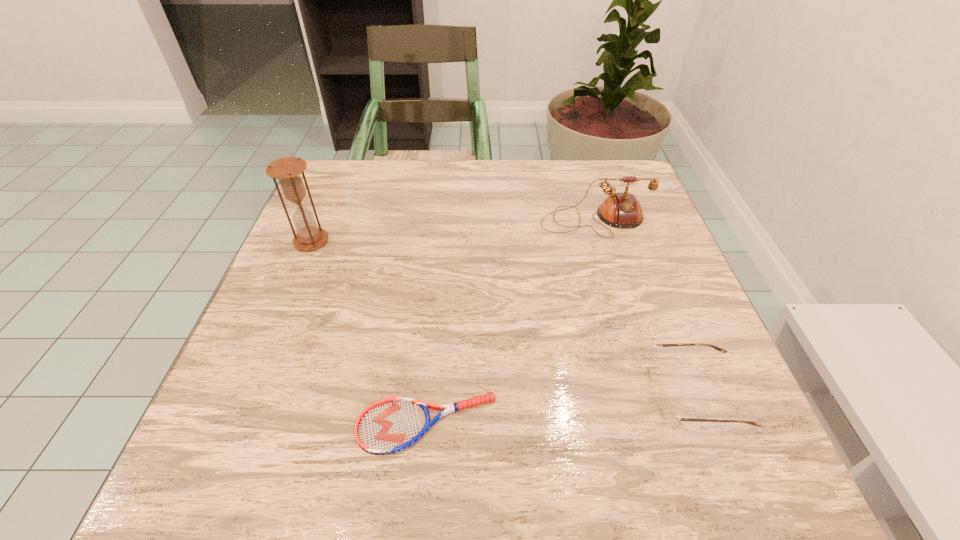
Image resolution: width=960 pixels, height=540 pixels. What are the coordinates of `hourglass` in the screenshot? It's located at (287, 170).

Find the location of a particular element. Image resolution: width=960 pixels, height=540 pixels. the leftmost object is located at coordinates (287, 170).

At what (x,y) coordinates should I click in order to perform the action: click on the second tallest object. Please return your answer as a coordinate pair (x, y). This screenshot has width=960, height=540. Looking at the image, I should click on (619, 210).

The image size is (960, 540). Find the location of `spectacles`. spectacles is located at coordinates (666, 408).

At what (x,y) coordinates should I click in order to perform the action: click on tennis racket. Please return your answer as a coordinate pair (x, y). Looking at the image, I should click on (390, 425).

Image resolution: width=960 pixels, height=540 pixels. I want to click on the shortest object, so click(390, 425).

This screenshot has height=540, width=960. What are the coordinates of `vacant space located on the front of the leftmost object` in the screenshot? It's located at (255, 376).

Locate an element on the screen. free space located on the rotary dial of the telephone is located at coordinates (616, 289).

Find the location of a particular element. vacant space situated on the front-facing side of the spectacles is located at coordinates (577, 393).

At what (x,y) coordinates should I click in order to perform the action: click on vacant region located 0.270m on the front-facing side of the spectacles. Please return your answer as a coordinate pair (x, y). Image resolution: width=960 pixels, height=540 pixels. Looking at the image, I should click on (485, 393).